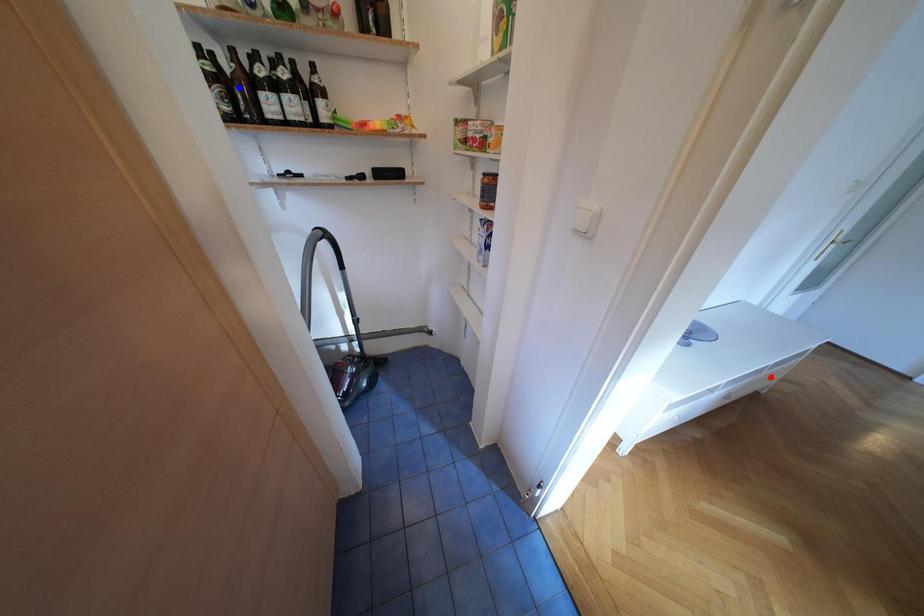
Question: Two points are marked on the image. Which point is closer to the camera?

Choices:
 (A) Blue point is closer.
 (B) Red point is closer.

Answer: (A)